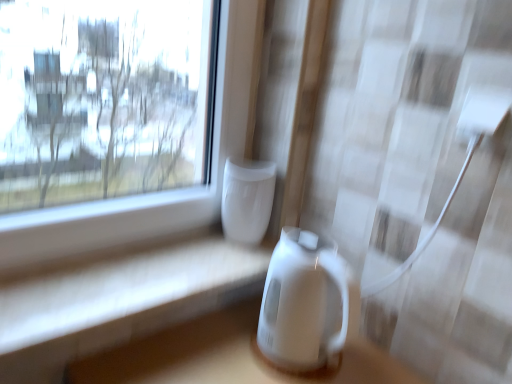
Question: Is white glossy table at lower center located within white glossy vase at center, which is the second appliance from bottom to top?

Choices:
 (A) no
 (B) yes

Answer: (A)

Question: From a real-world perspective, is white glossy vase at center, placed as the 1th appliance when sorted from top to bottom, under white glossy table at lower center?

Choices:
 (A) yes
 (B) no

Answer: (B)

Question: Is white glossy vase at center, placed as the 1th appliance when sorted from top to bottom, to the right of white glossy table at lower center from the viewer's perspective?

Choices:
 (A) yes
 (B) no

Answer: (A)

Question: Can you confirm if white glossy vase at center, placed as the 1th appliance when sorted from top to bottom, is taller than white glossy table at lower center?

Choices:
 (A) no
 (B) yes

Answer: (B)

Question: From the image's perspective, is white glossy vase at center, which is the second appliance from bottom to top, on white glossy table at lower center?

Choices:
 (A) no
 (B) yes

Answer: (B)

Question: Can you confirm if white glossy vase at center, which is the second appliance from bottom to top, is wider than white glossy table at lower center?

Choices:
 (A) no
 (B) yes

Answer: (A)

Question: From the image's perspective, is white glossy electric kettle at center, positioned as the 1th appliance in bottom-to-top order, beneath white glossy table at lower center?

Choices:
 (A) no
 (B) yes

Answer: (B)

Question: From the image's perspective, is white glossy electric kettle at center, the second appliance positioned from the top, on white glossy table at lower center?

Choices:
 (A) no
 (B) yes

Answer: (A)

Question: Is white glossy table at lower center located within white glossy electric kettle at center, positioned as the 1th appliance in bottom-to-top order?

Choices:
 (A) yes
 (B) no

Answer: (B)

Question: Does white glossy electric kettle at center, the second appliance positioned from the top, lie behind white glossy table at lower center?

Choices:
 (A) yes
 (B) no

Answer: (A)

Question: Can you confirm if white glossy electric kettle at center, positioned as the 1th appliance in bottom-to-top order, is bigger than white glossy table at lower center?

Choices:
 (A) no
 (B) yes

Answer: (B)

Question: Is white glossy electric kettle at center, positioned as the 1th appliance in bottom-to-top order, facing towards white glossy table at lower center?

Choices:
 (A) yes
 (B) no

Answer: (B)

Question: Is white glossy vase at center, placed as the 1th appliance when sorted from top to bottom, shorter than white glossy electric kettle at center, positioned as the 1th appliance in bottom-to-top order?

Choices:
 (A) yes
 (B) no

Answer: (A)